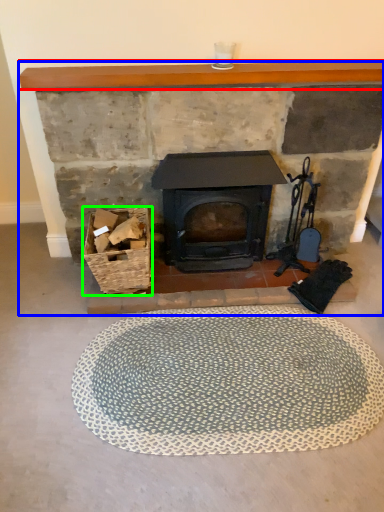
Question: Which object is positioned farthest from balustrade (highlighted by a red box)? Select from fireplace (highlighted by a blue box) and basket (highlighted by a green box).

Choices:
 (A) fireplace
 (B) basket

Answer: (B)